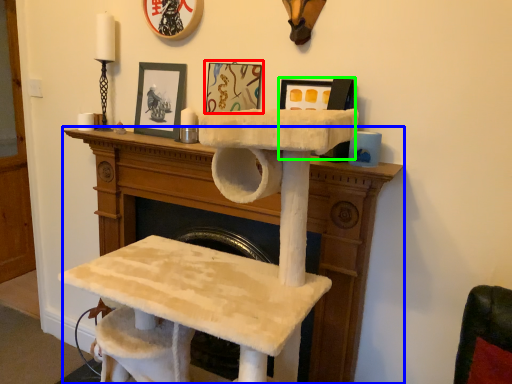
Question: Based on their relative distances, which object is farther from picture frame (highlighted by a red box)? Choose from furniture (highlighted by a blue box) and picture frame (highlighted by a green box).

Choices:
 (A) furniture
 (B) picture frame

Answer: (A)